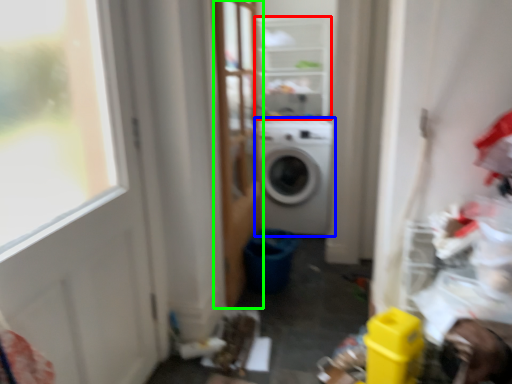
Question: Considering the real-world distances, which object is closest to shelf (highlighted by a red box)? washing machine (highlighted by a blue box) or screen door (highlighted by a green box).

Choices:
 (A) washing machine
 (B) screen door

Answer: (B)